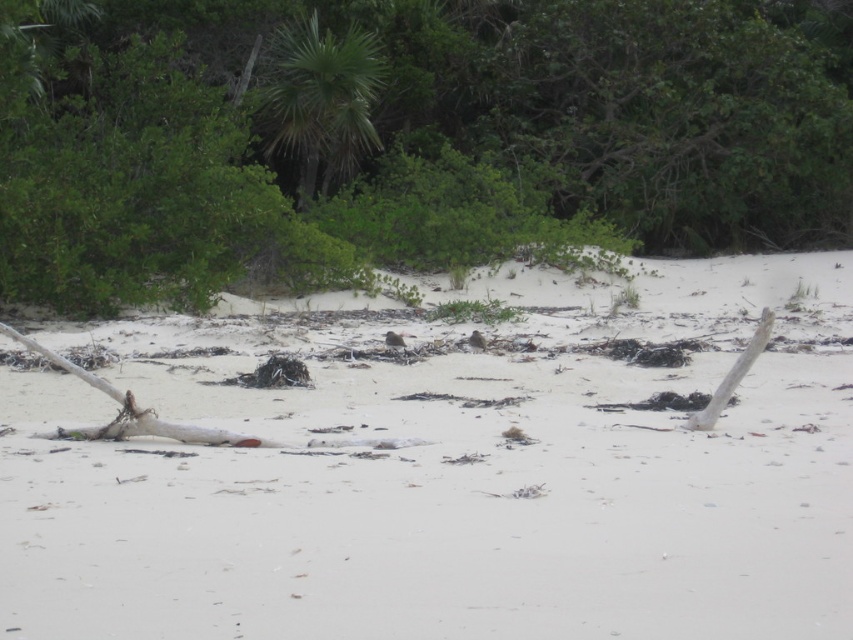
You are standing at the point labeled point (432, 502) in the image. What is the terrain like at that location?

The terrain at point (432, 502) is a white sandy beach at center.

You are standing at the origin point of the coordinate system. You want to walk to the white sandy beach at center. According to the coordinate provided, in which direction should you move?

The white sandy beach at center is located at coordinate point 0.786 on the x axis and 0.508 on the y axis. Since the origin is at the bottom left corner, you should move to the right and slightly upwards to reach the white sandy beach at center.

From the picture: You are a bird looking for a nesting spot. You see two trees in the scene, the green leafy tree at upper center and the green leafy palm tree at upper center. Which tree has a larger canopy for nesting?

The green leafy tree at upper center is bigger than the green leafy palm tree at upper center, so it has a larger canopy for nesting.